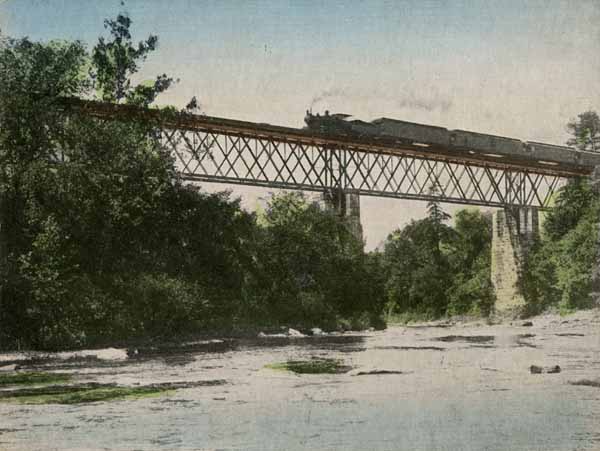
This screenshot has width=600, height=451. Identify the location of metal support poles. (401, 195), (283, 163), (222, 156), (475, 182).